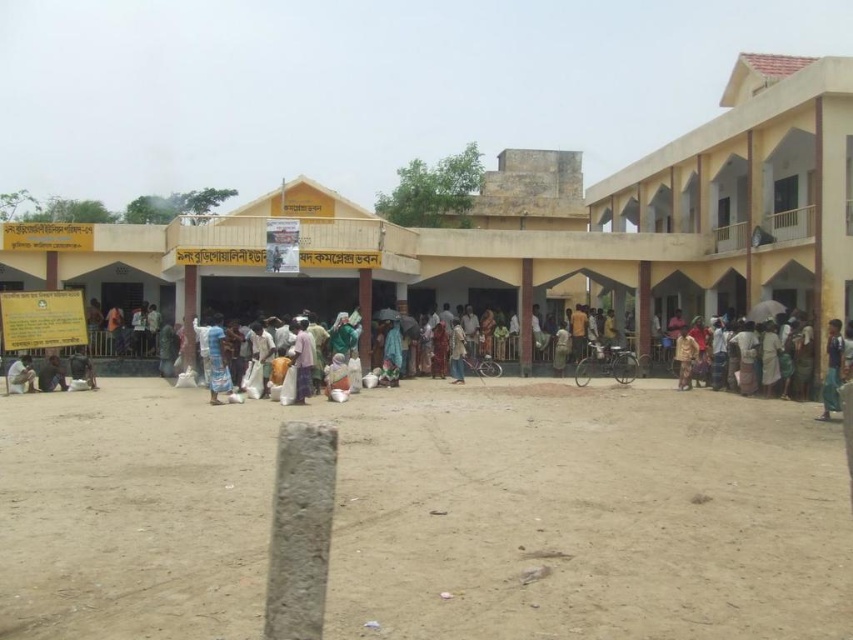
You are organizing a picnic and have brought a dark green fabric at lower left and a white cotton cloth at center. You want to spread them out in the open area in front of the building. Which fabric should you place first if you want to arrange them from left to right as per their current positions?

The dark green fabric at lower left should be placed first since it is already positioned to the left of the white cotton cloth at center, aligning with the left to right arrangement.

You are standing in front of the building and want to walk from point (61, 387) to point (332, 388). Which direction should you move relative to your current position?

You should move backward because point (61, 387) is closer to you than point (332, 388), which is further away.